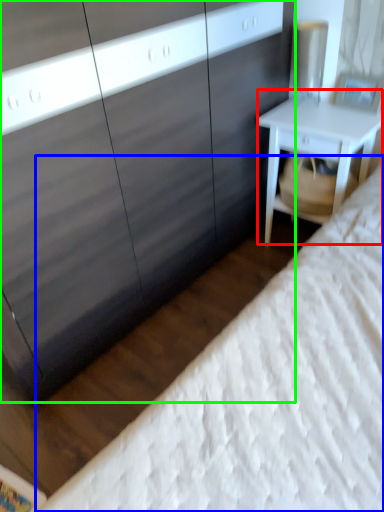
Question: Which is farther away from nightstand (highlighted by a red box)? bed (highlighted by a blue box) or dresser (highlighted by a green box)?

Choices:
 (A) bed
 (B) dresser

Answer: (A)